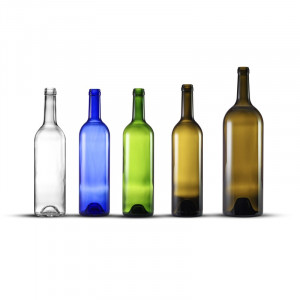
Locate an element on the screen. Image resolution: width=300 pixels, height=300 pixels. colored bottles is located at coordinates (99, 151), (136, 154), (182, 154), (241, 150).